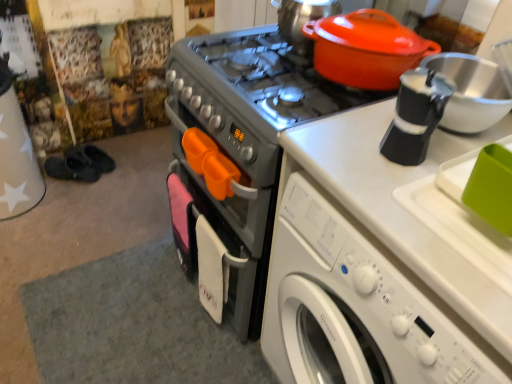
The width and height of the screenshot is (512, 384). In order to click on free location above matte orange pot at upper right (from a real-world perspective) in this screenshot , I will do `click(367, 20)`.